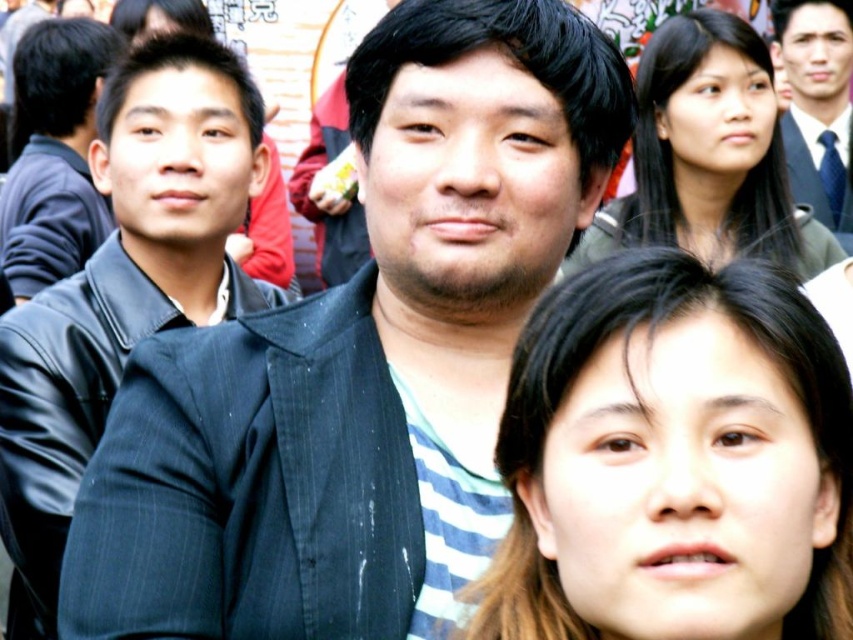
You are a photographer standing 10 meters away from the scene. You want to take a photo that includes both the brown hair at lower center and the matte black jacket at left. Given that your camera has a maximum zoom range of 50 meters, can you capture both subjects in the same frame?

The brown hair at lower center and the matte black jacket at left are 43.22 meters apart from each other. Since your camera can zoom up to 50 meters, you can capture both subjects in the same frame as 43.22 meters is within the camera range.

You are a photographer trying to adjust the lighting for a portrait. You notice two elements in the frame that might cast shadows. The brown hair at lower center and the matte black jacket at left. Which of these elements is more likely to cast a shadow on the other?

The matte black jacket at left is positioned above the brown hair at lower center, so it will cast a shadow on the brown hair at lower center.